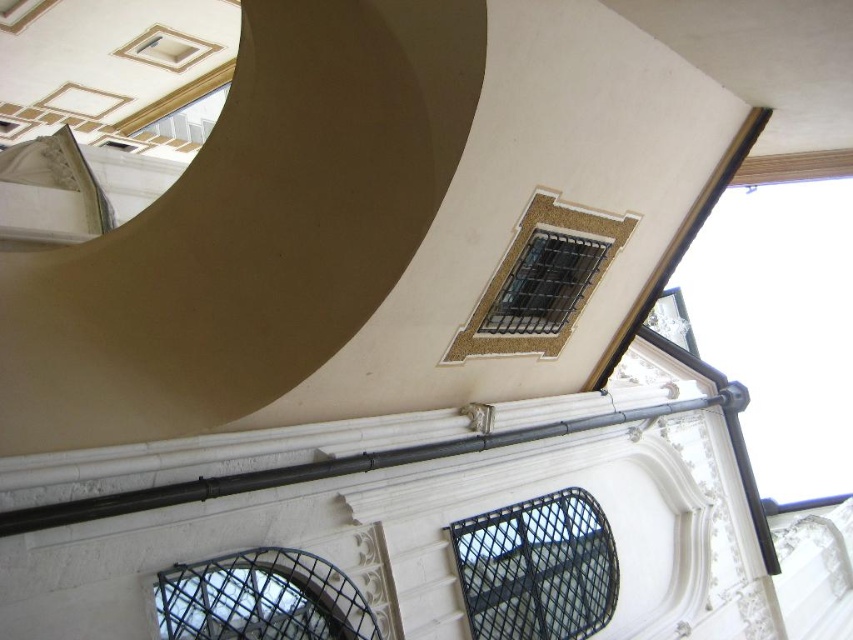
Question: Based on their relative distances, which object is farther from the metallic mesh window at upper center?

Choices:
 (A) black metal pipe at center
 (B) black metal grid at lower left

Answer: (B)

Question: Observing the image, what is the correct spatial positioning of black mesh window at upper center in reference to metallic mesh window at upper center?

Choices:
 (A) above
 (B) below

Answer: (B)

Question: Can you confirm if gold mosaic window at upper center is wider than black metal grid at lower left?

Choices:
 (A) yes
 (B) no

Answer: (A)

Question: Which object is farther from the camera taking this photo?

Choices:
 (A) metallic mesh window at upper center
 (B) black metal pipe at center
 (C) black metal grid at lower left

Answer: (A)

Question: Considering the real-world distances, which object is farthest from the metallic mesh window at upper center?

Choices:
 (A) black metal pipe at center
 (B) black mesh window at upper center
 (C) gold mosaic window at upper center
 (D) black metal grid at lower left

Answer: (B)

Question: Observing the image, what is the correct spatial positioning of black metal pipe at center in reference to metallic mesh window at upper center?

Choices:
 (A) below
 (B) above

Answer: (A)